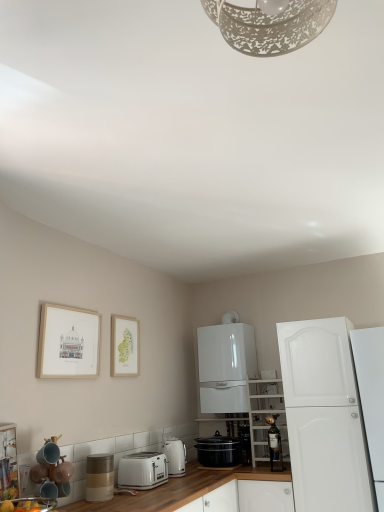
I want to click on vacant region to the left of metallic gold wine bottle at center, which is counted as the 1th appliance, starting from the right, so click(254, 471).